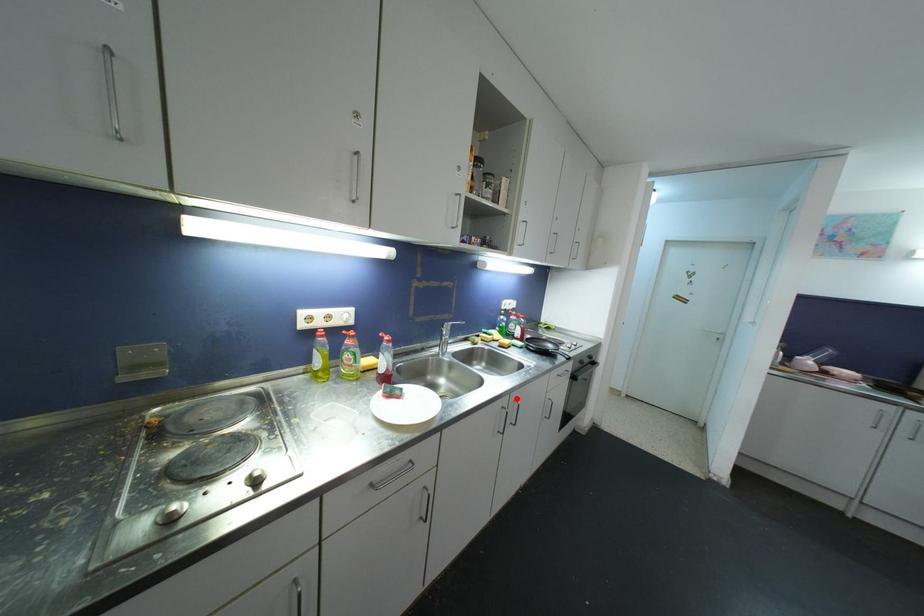
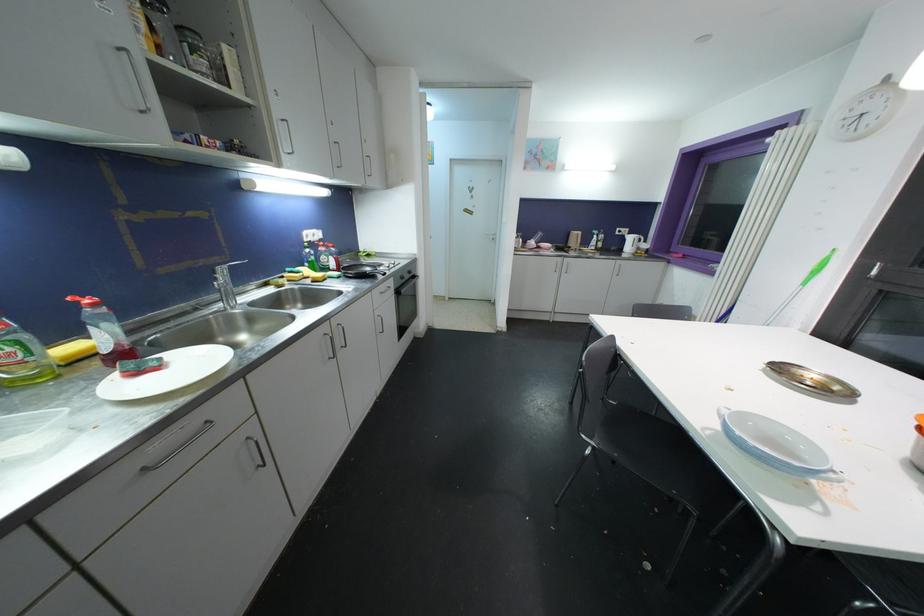
Question: I am providing you with two images of the same scene from different viewpoints. A red point is shown in image1. For the corresponding object point in image2, is it positioned nearer or farther from the camera?

Choices:
 (A) Nearer
 (B) Farther

Answer: (A)